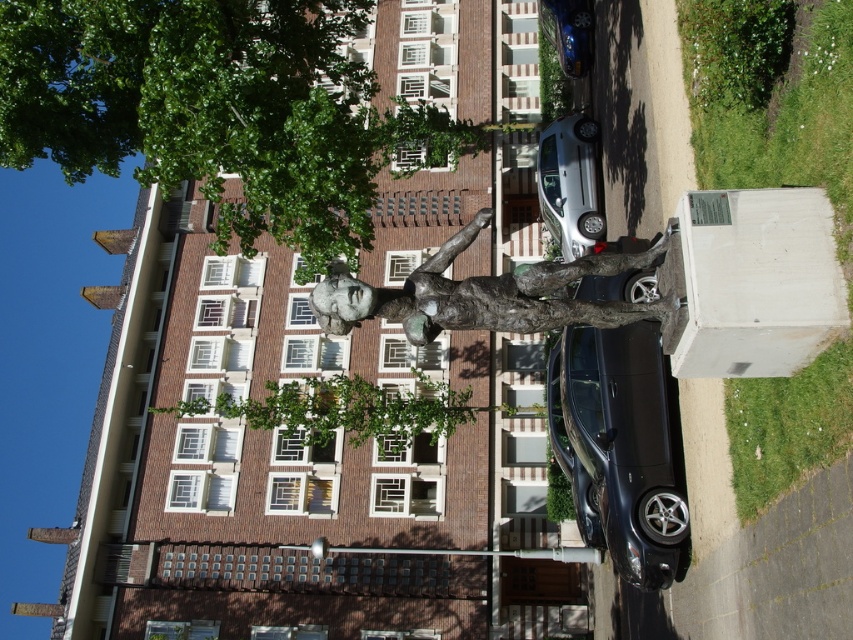
Question: Is green leafy tree at upper left above shiny black sedan at center?

Choices:
 (A) no
 (B) yes

Answer: (B)

Question: Which object is positioned closest to the shiny blue car at upper center?

Choices:
 (A) silver metallic car at center
 (B) bronze statue at center
 (C) green leafy tree at center
 (D) green leafy tree at upper left

Answer: (A)

Question: Which object is farther from the camera taking this photo?

Choices:
 (A) silver metallic car at center
 (B) shiny black sedan at center

Answer: (A)

Question: Is bronze statue at center bigger than silver metallic car at center?

Choices:
 (A) yes
 (B) no

Answer: (A)

Question: Which point appears farthest from the camera in this image?

Choices:
 (A) (582, 433)
 (B) (538, 154)
 (C) (451, 138)

Answer: (C)

Question: Is shiny black sedan at center closer to camera compared to silver metallic car at center?

Choices:
 (A) no
 (B) yes

Answer: (B)